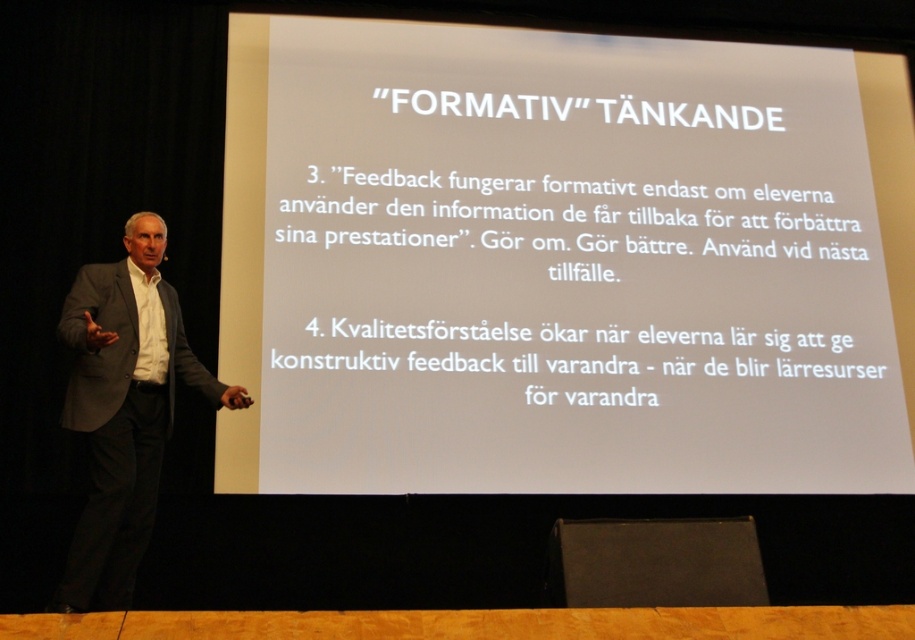
From the picture: Based on the scene description and the objects provided, what does the point at coordinates (124,410) indicate?

The point at coordinates (124,410) marks the location of the dark gray suit at left.

You are an event organizer setting up a presentation. You have a white paper at upper center and a black fabric speaker at lower center. Which object is wider from the audience perspective?

The white paper at upper center might be wider than the black fabric speaker at lower center according to the description.